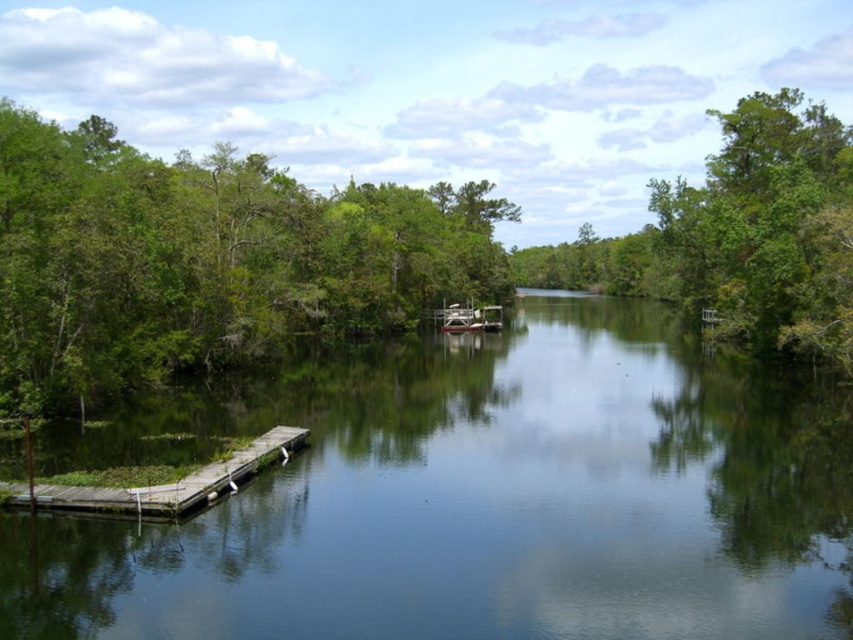
You are standing at the point with coordinates (207,260) in the river scene. What object are you standing on?

The point at coordinates (207,260) indicates a green leafy tree at left, so you are standing on the green leafy tree at left.

You are standing on the wooden dock at left and want to pick a leaf from the green leafy tree at left. Can you reach the leaf without climbing the tree?

The green leafy tree at left is located above the wooden dock at left, so you can reach the leaf without climbing the tree since it is within arm height.

You are an environmental scientist studying the river ecosystem. You observe the green leafy tree at left and the green leafy tree at upper right. Which tree would you recommend for a study on tree size and its impact on riverbank stability, and why?

The green leafy tree at left is larger in size than the green leafy tree at upper right, so it would be more suitable for studying the impact of tree size on riverbank stability since larger trees typically have deeper root systems that can better stabilize the soil.